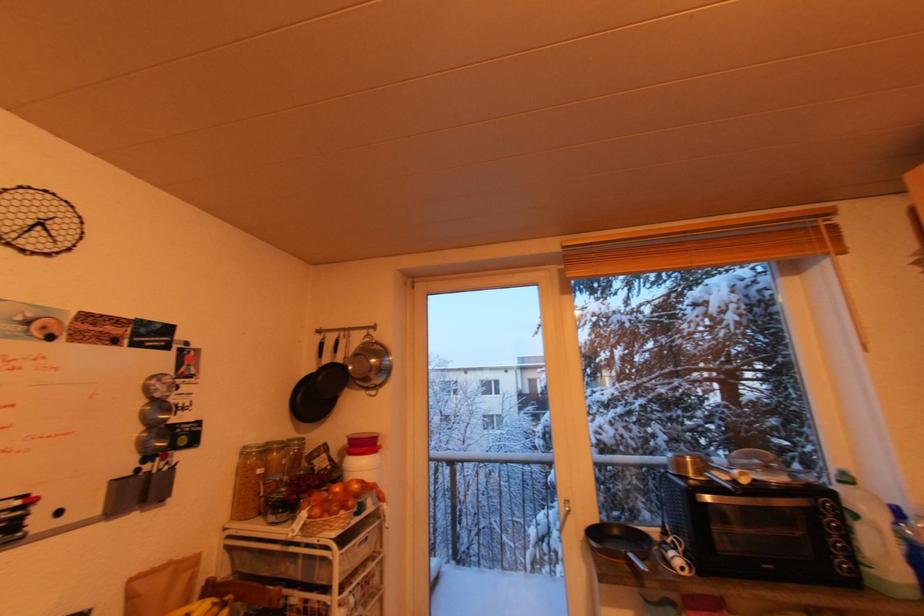
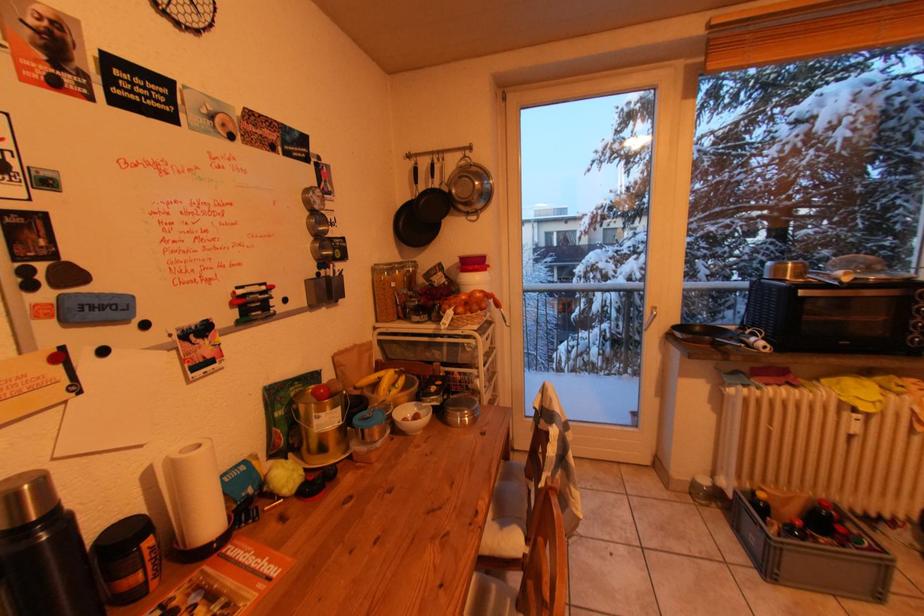
Question: In a continuous first-person perspective shot, in which direction is the camera moving?

Choices:
 (A) Left
 (B) Right
 (C) Forward
 (D) Backward

Answer: (A)